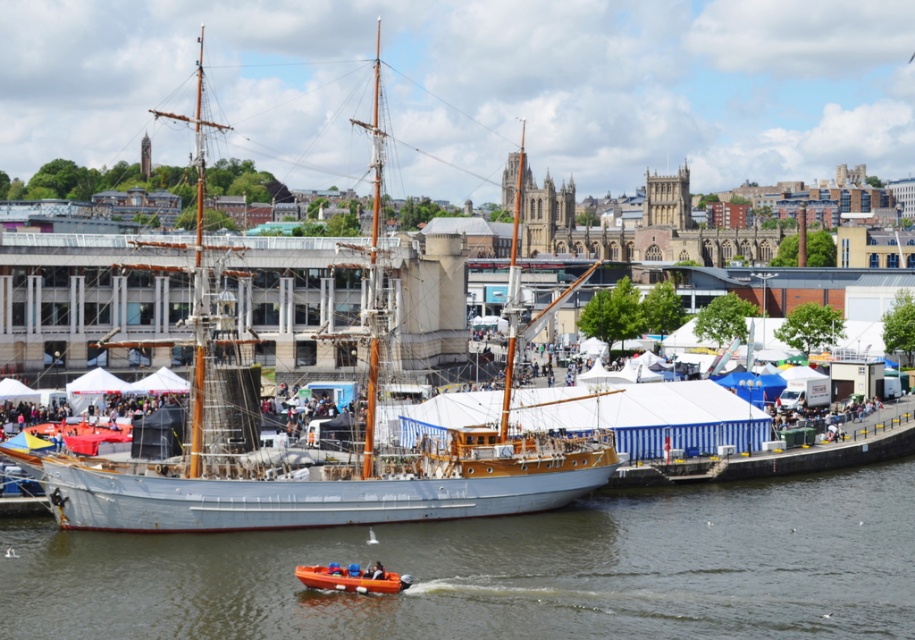
Question: In this image, where is brown wooden boat at center located relative to orange rubber dinghy at lower center?

Choices:
 (A) left
 (B) right

Answer: (B)

Question: Which of the following is the farthest from the observer?

Choices:
 (A) brown wooden boat at center
 (B) white wooden ship at center

Answer: (B)

Question: Which of the following is the farthest from the observer?

Choices:
 (A) (51, 538)
 (B) (375, 182)

Answer: (B)

Question: Which of these objects is positioned closest to the orange rubber dinghy at lower center?

Choices:
 (A) white wooden ship at center
 (B) brown wooden boat at center

Answer: (B)

Question: Is brown wooden boat at center further to the viewer compared to orange rubber dinghy at lower center?

Choices:
 (A) yes
 (B) no

Answer: (B)

Question: Does brown wooden boat at center have a greater width compared to orange rubber dinghy at lower center?

Choices:
 (A) no
 (B) yes

Answer: (B)